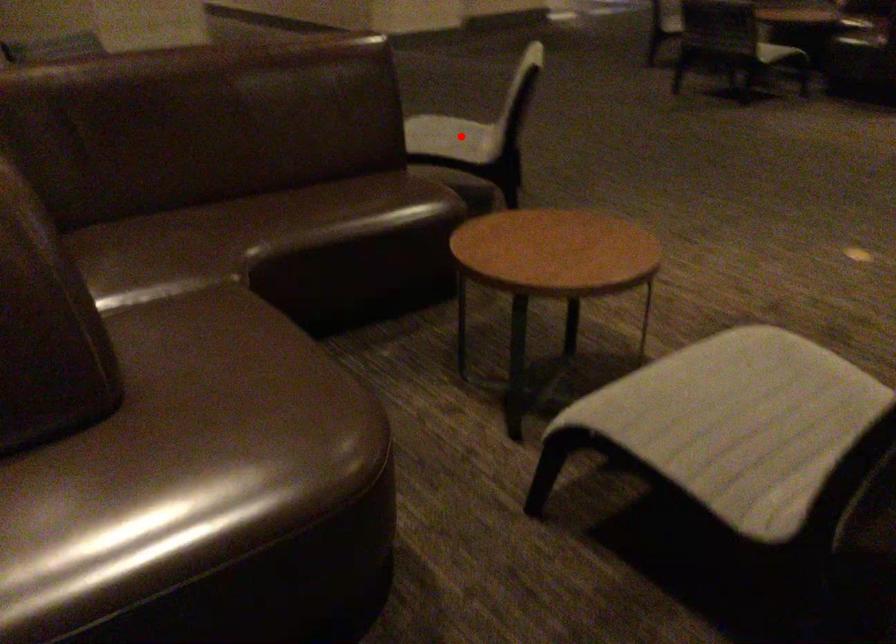
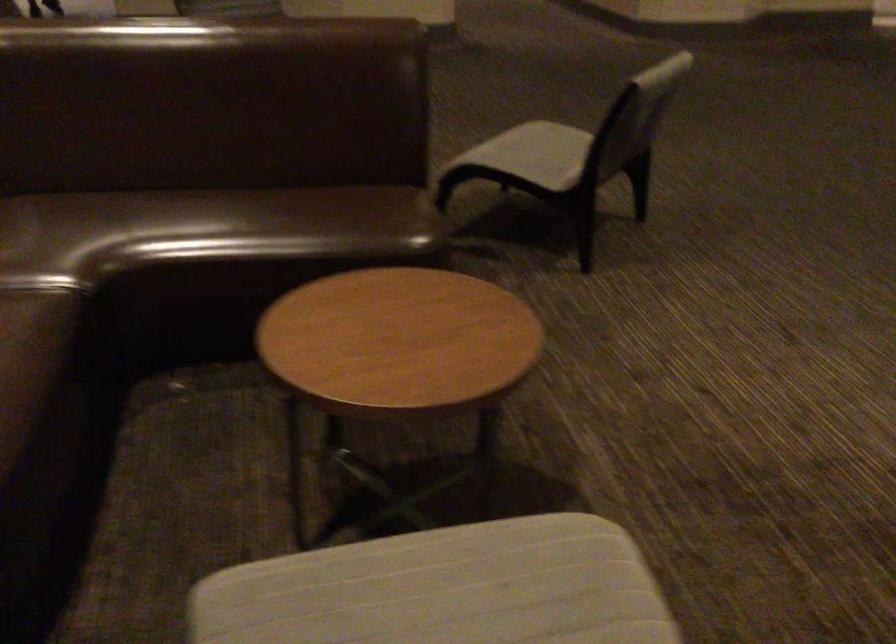
In the second image, find the point that corresponds to the highlighted location in the first image.

(533, 154)